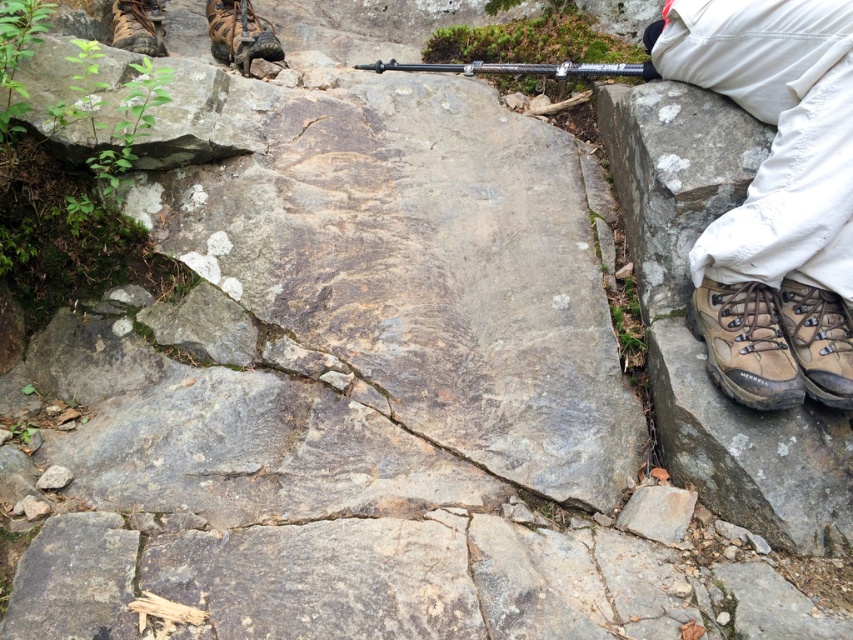
Does silver metallic gun at upper center have a larger size compared to brown leather shoe at upper left?

Yes, silver metallic gun at upper center is bigger than brown leather shoe at upper left.

Who is positioned more to the left, silver metallic gun at upper center or brown leather shoe at upper left?

brown leather shoe at upper left is more to the left.

Does point (473, 68) come behind point (122, 13)?

No, it is in front of (122, 13).

This screenshot has width=853, height=640. Identify the location of silver metallic gun at upper center. (515, 68).

The width and height of the screenshot is (853, 640). I want to click on brown leather boots at lower right, so click(x=776, y=196).

Which is behind, point (688, 22) or point (432, 67)?

Point (432, 67)

Is point (770, 371) behind point (438, 64)?

That is False.

Locate an element on the screen. Image resolution: width=853 pixels, height=640 pixels. brown leather boots at lower right is located at coordinates (776, 196).

In the scene shown: Can you confirm if brown leather boots at lower right is bigger than brown leather boot at right?

Indeed, brown leather boots at lower right has a larger size compared to brown leather boot at right.

Is brown leather boots at lower right above brown leather boot at right?

Yes.

Is point (846, 179) farther from camera compared to point (811, 340)?

No, it is not.

Locate an element on the screen. Image resolution: width=853 pixels, height=640 pixels. brown leather boots at lower right is located at coordinates (776, 196).